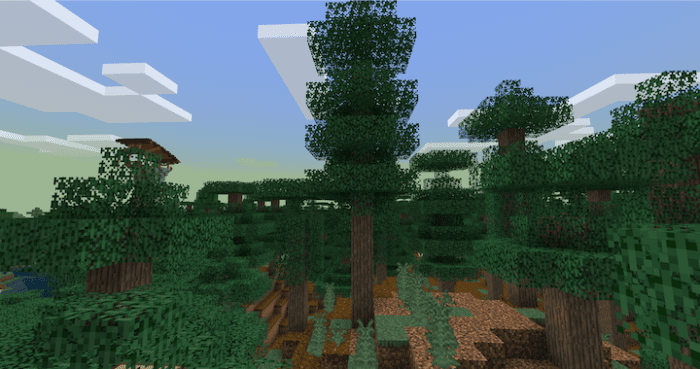
The image size is (700, 369). Find the location of `canopy`. canopy is located at coordinates (357, 34), (126, 187), (496, 107), (638, 130).